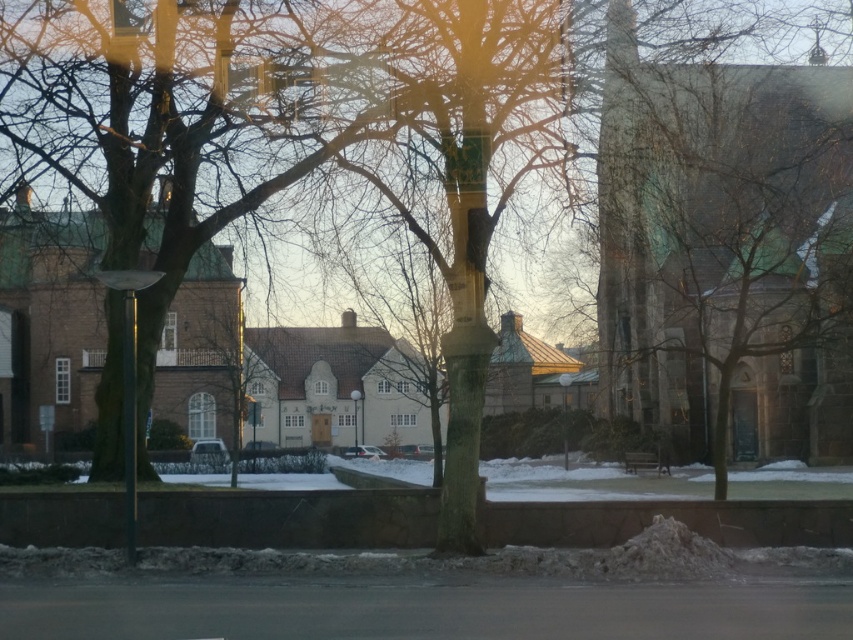
Can you confirm if smooth gray stone church tower at right is smaller than brown textured tree at left?

Incorrect, smooth gray stone church tower at right is not smaller in size than brown textured tree at left.

Locate an element on the screen. This screenshot has height=640, width=853. smooth gray stone church tower at right is located at coordinates (718, 237).

Which of these two, brown textured tree at left or metallic pole at center, stands taller?

Standing taller between the two is brown textured tree at left.

Is brown textured tree at left below metallic pole at center?

Actually, brown textured tree at left is above metallic pole at center.

Which is in front, point (349, 129) or point (129, 548)?

Point (129, 548) is more forward.

Where is `brown textured tree at left`? brown textured tree at left is located at coordinates (189, 115).

Who is higher up, smooth gray stone church tower at right or metallic pole at center?

Positioned higher is smooth gray stone church tower at right.

Between point (722, 470) and point (131, 292), which one is positioned behind?

The point (722, 470) is behind.

This screenshot has width=853, height=640. In order to click on smooth gray stone church tower at right in this screenshot , I will do `click(718, 237)`.